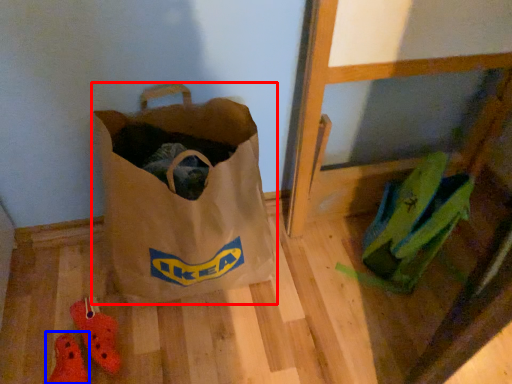
Question: Which object appears closest to the camera in this image, luggage and bags (highlighted by a red box) or footwear (highlighted by a blue box)?

Choices:
 (A) luggage and bags
 (B) footwear

Answer: (A)